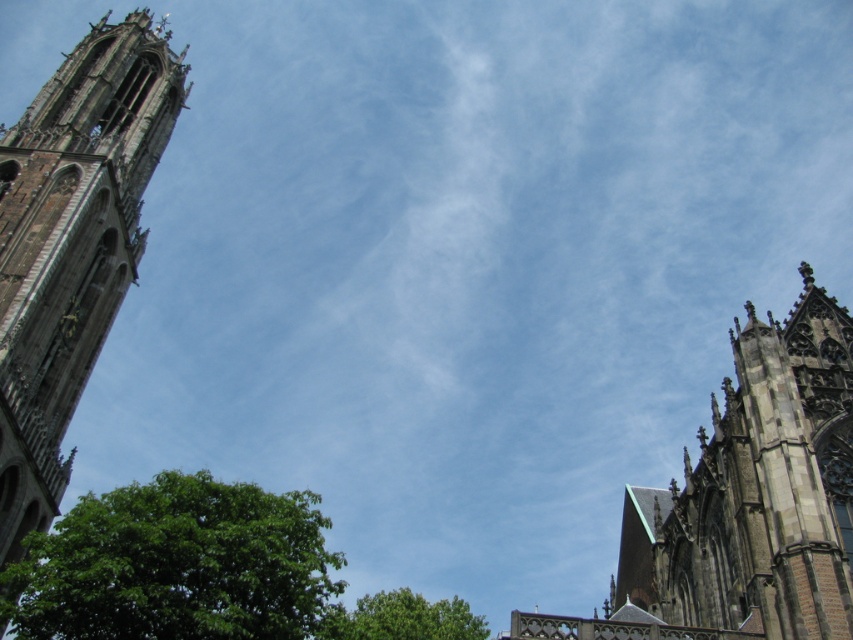
Which of these two, stone gothic tower at left or green leafy tree at lower center, stands taller?

stone gothic tower at left is taller.

Who is more distant from viewer, (39, 225) or (323, 614)?

The point (39, 225) is behind.

Who is more forward, (91,253) or (413,596)?

Point (91,253) is more forward.

I want to click on stone gothic tower at left, so click(73, 244).

Between brown stone tower at right and green leafy tree at lower left, which one appears on the right side from the viewer's perspective?

Positioned to the right is brown stone tower at right.

The image size is (853, 640). In order to click on brown stone tower at right in this screenshot , I will do `click(758, 490)`.

Identify the location of brown stone tower at right. (758, 490).

What do you see at coordinates (73, 244) in the screenshot? The width and height of the screenshot is (853, 640). I see `stone gothic tower at left` at bounding box center [73, 244].

Is point (54, 289) less distant than point (235, 598)?

No, it is not.

Where is `stone gothic tower at left`? stone gothic tower at left is located at coordinates (73, 244).